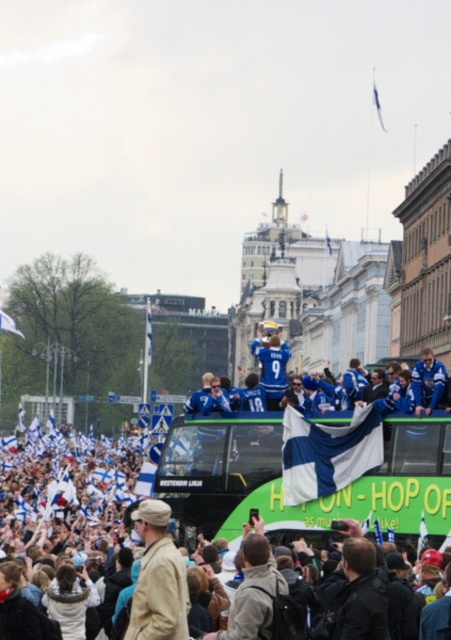
You are a photographer standing at the center of the scene. You want to capture a photo of the blue jersey at center. Based on the coordinates provided, where should you aim your camera?

The blue jersey at center is located at coordinates point 0.613 on the x axis and 0.865 on the y axis, so you should aim your camera at that specific point to capture the blue jersey at center.